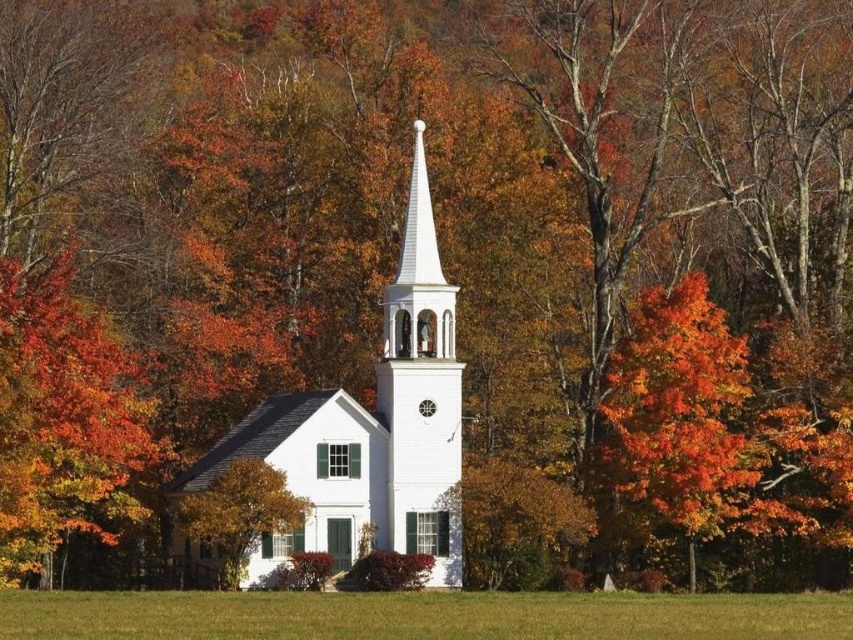
You are standing in front of the church and want to determine the relative positions of two points in the scene. Which of the two points, point (700, 636) or point (421, 381), is closer to you?

Point (700, 636) is closer to the viewer than point (421, 381).

You are standing at the base of the church and looking towards the steeple. There are two points marked on the steeple. Which point is closer to you, point [425,538] or point [440,536]?

Point [425,538] is in front of point [440,536], so it is closer to you.

You are standing at the point marked by coordinates point [370,429]. Looking around, you see the white smooth church steeple at center. Which direction should you face to look directly at the steeple?

You are already at the point [370,429], which represents the white smooth church steeple at center. Therefore, you are at the steeple itself and don not need to face any direction to look at it.